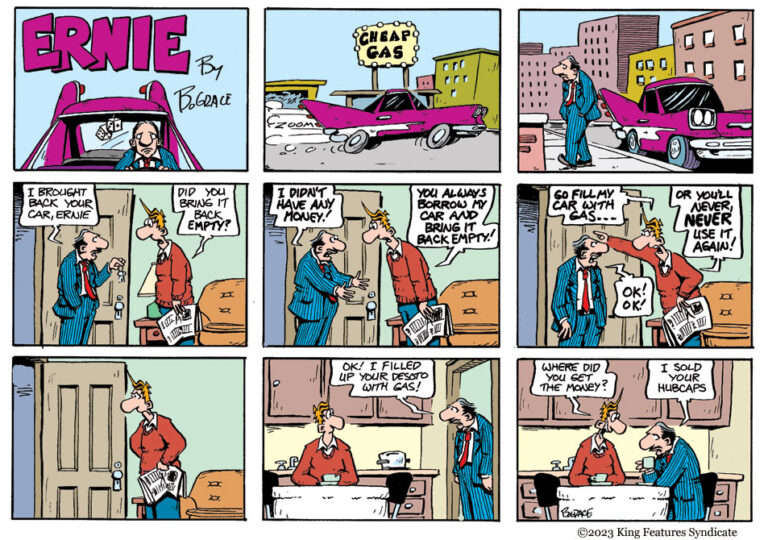
The width and height of the screenshot is (768, 540). What are the coordinates of `sofa` in the screenshot? It's located at (232, 309), (224, 490), (478, 300), (737, 301).